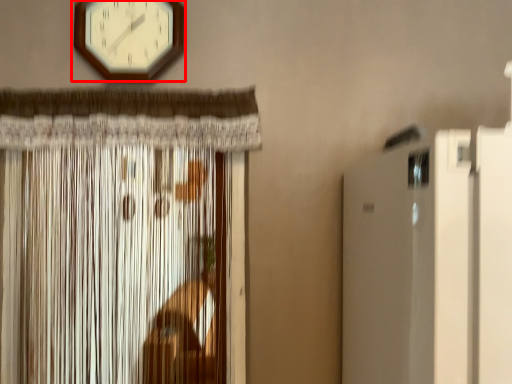
Question: From the image's perspective, what is the correct spatial positioning of wall clock (annotated by the red box) in reference to curtain?

Choices:
 (A) above
 (B) below

Answer: (A)